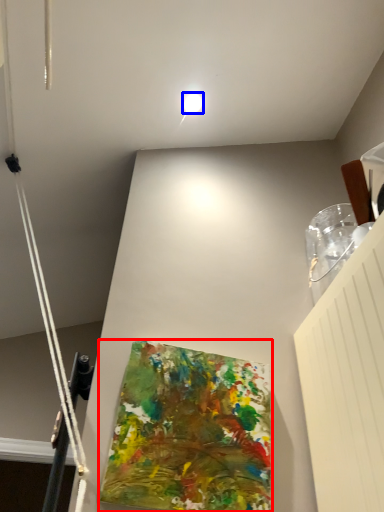
Question: Among these objects, which one is nearest to the camera, art (highlighted by a red box) or droplight (highlighted by a blue box)?

Choices:
 (A) art
 (B) droplight

Answer: (A)